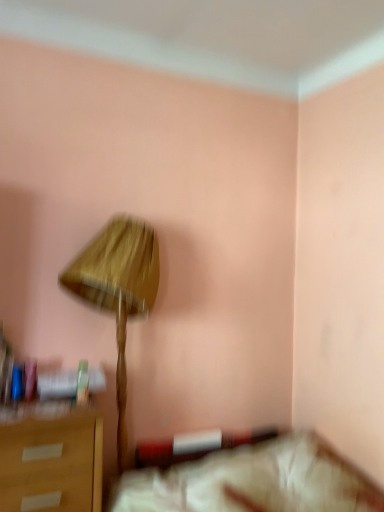
Question: Is wooden lampshade at center to the left of white fabric bed at lower right from the viewer's perspective?

Choices:
 (A) yes
 (B) no

Answer: (A)

Question: Can white fabric bed at lower right be found inside wooden lampshade at center?

Choices:
 (A) yes
 (B) no

Answer: (B)

Question: Considering the relative sizes of wooden lampshade at center and white fabric bed at lower right in the image provided, is wooden lampshade at center wider than white fabric bed at lower right?

Choices:
 (A) yes
 (B) no

Answer: (B)

Question: Is there a large distance between wooden lampshade at center and white fabric bed at lower right?

Choices:
 (A) no
 (B) yes

Answer: (A)

Question: From a real-world perspective, is wooden lampshade at center beneath white fabric bed at lower right?

Choices:
 (A) yes
 (B) no

Answer: (B)

Question: Is wooden lampshade at center thinner than white fabric bed at lower right?

Choices:
 (A) no
 (B) yes

Answer: (B)

Question: From a real-world perspective, is white fabric bed at lower right physically above wooden lampshade at center?

Choices:
 (A) yes
 (B) no

Answer: (B)

Question: Is white fabric bed at lower right oriented towards wooden lampshade at center?

Choices:
 (A) no
 (B) yes

Answer: (A)

Question: From a real-world perspective, is white fabric bed at lower right positioned under wooden lampshade at center based on gravity?

Choices:
 (A) yes
 (B) no

Answer: (A)

Question: Does white fabric bed at lower right have a lesser height compared to wooden lampshade at center?

Choices:
 (A) no
 (B) yes

Answer: (B)

Question: Is white fabric bed at lower right thinner than wooden lampshade at center?

Choices:
 (A) no
 (B) yes

Answer: (A)

Question: Does white fabric bed at lower right lie behind wooden lampshade at center?

Choices:
 (A) no
 (B) yes

Answer: (A)

Question: Is wooden lampshade at center wider or thinner than white fabric bed at lower right?

Choices:
 (A) thin
 (B) wide

Answer: (A)